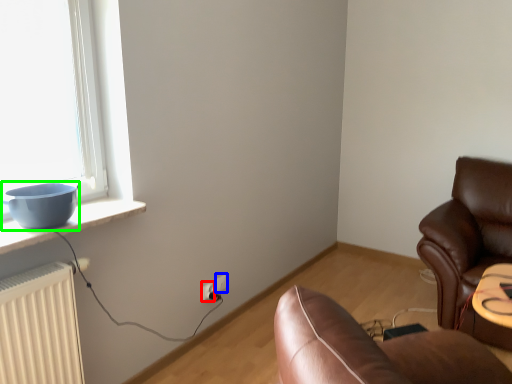
Question: Based on their relative distances, which object is farther from electric outlet (highlighted by a red box)? Choose from electric outlet (highlighted by a blue box) and bowl (highlighted by a green box).

Choices:
 (A) electric outlet
 (B) bowl

Answer: (B)